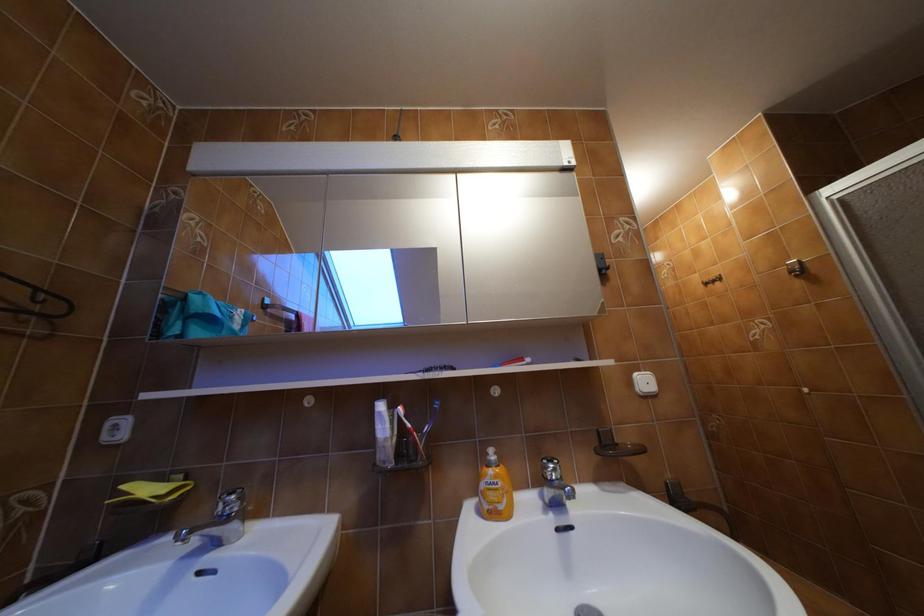
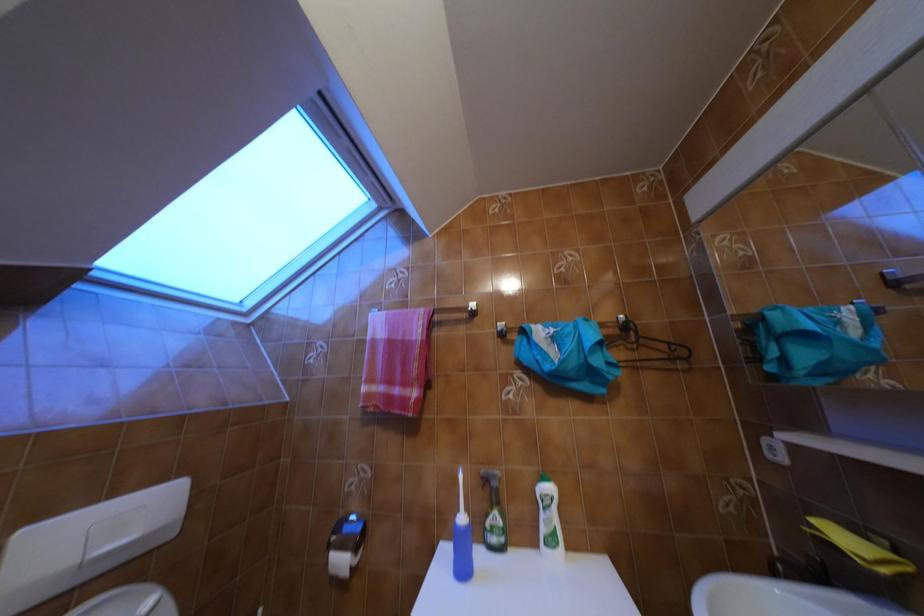
Question: Based on the continuous images, in which direction is the camera rotating? Reply with the corresponding letter.

Choices:
 (A) Left
 (B) Right
 (C) Up
 (D) Down

Answer: (A)